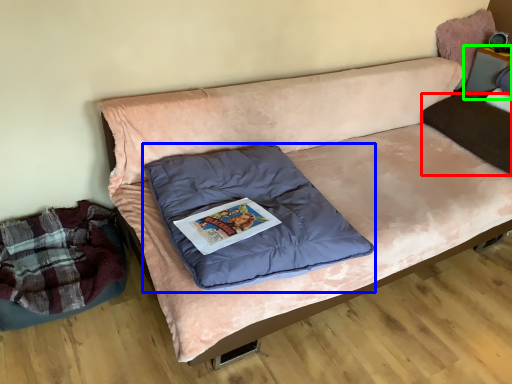
Question: Considering the real-world distances, which object is farthest from pillow (highlighted by a red box)? pillow (highlighted by a blue box) or furniture (highlighted by a green box)?

Choices:
 (A) pillow
 (B) furniture

Answer: (A)